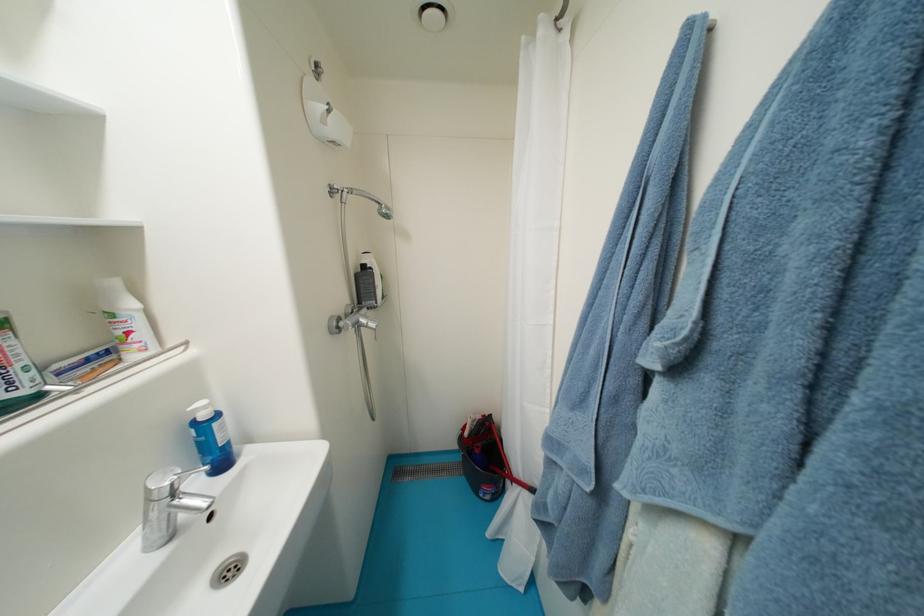
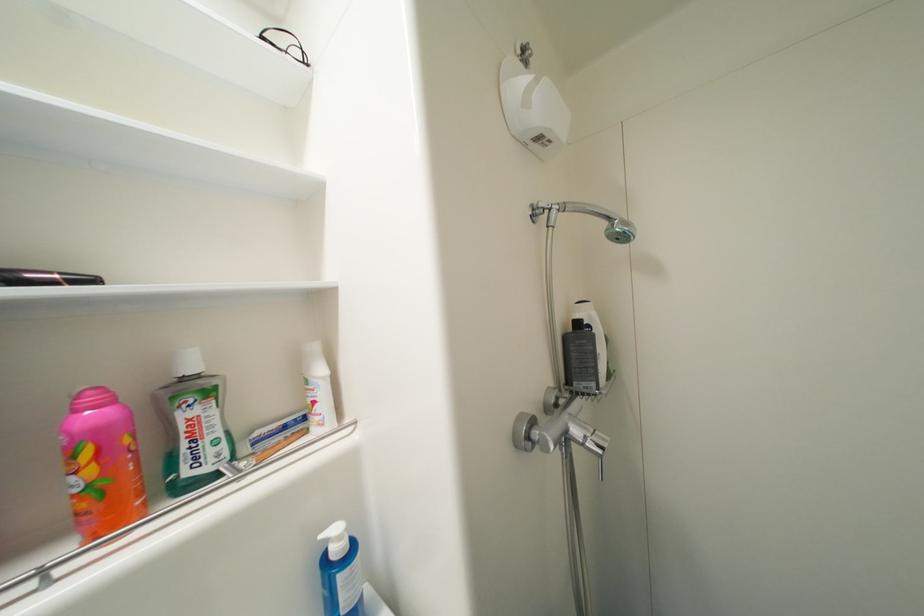
Question: The camera is either moving clockwise (left) or counter-clockwise (right) around the object. The first image is from the beginning of the video and the second image is from the end. Is the camera moving left or right when shooting the video?

Choices:
 (A) Left
 (B) Right

Answer: (B)